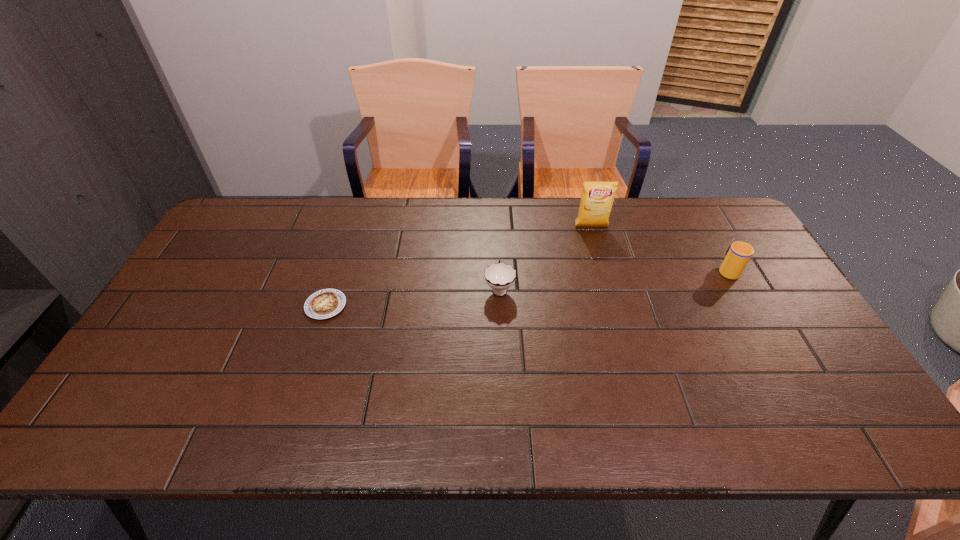
The image size is (960, 540). Find the location of `vacant space at the left edge`. vacant space at the left edge is located at coordinates point(213,294).

The image size is (960, 540). I want to click on vacant space at the right edge, so click(744, 321).

This screenshot has width=960, height=540. In the image, there is a desktop. What are the coordinates of `vacant space at the near left corner` in the screenshot? It's located at (133, 440).

This screenshot has height=540, width=960. Identify the location of vacant position at the far right corner of the desktop. (728, 231).

Image resolution: width=960 pixels, height=540 pixels. Identify the location of empty space that is in between the crisp (potato chip) and the taller cup. (660, 248).

The image size is (960, 540). I want to click on free space between the quiche and the taller cup, so click(x=527, y=288).

Identify the location of blank region between the tallest object and the taller cup. The width and height of the screenshot is (960, 540). (660, 248).

Locate an element on the screen. free point between the right cup and the second object from right to left is located at coordinates (660, 248).

Locate an element on the screen. free point between the third object from right to left and the taller cup is located at coordinates (613, 279).

Identify the location of empty space between the second object from left to right and the farthest object. Image resolution: width=960 pixels, height=540 pixels. (545, 258).